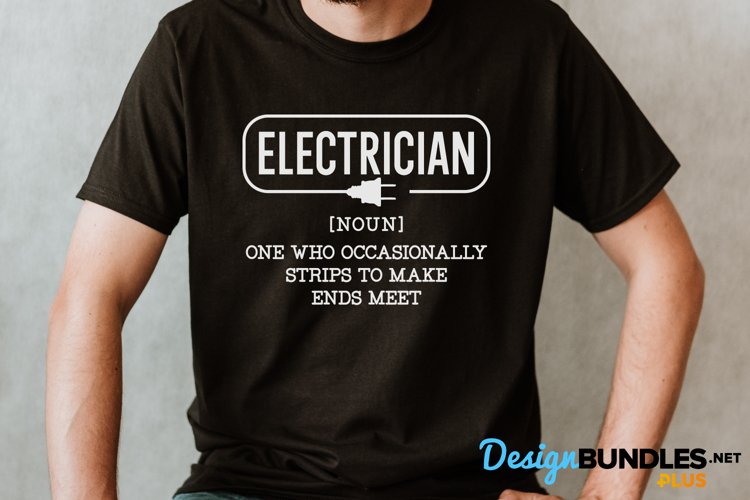
Identify the location of plug. The image size is (750, 500). (373, 197).